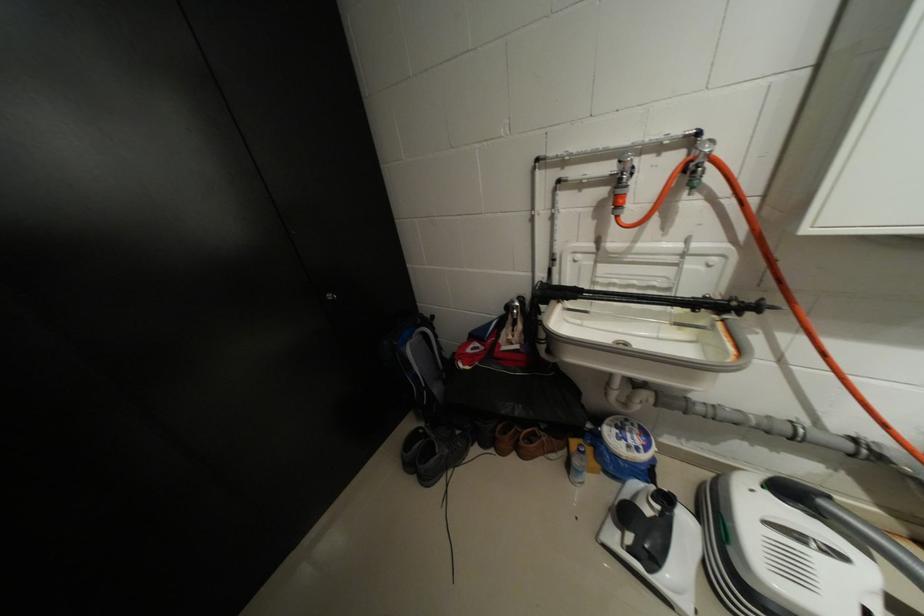
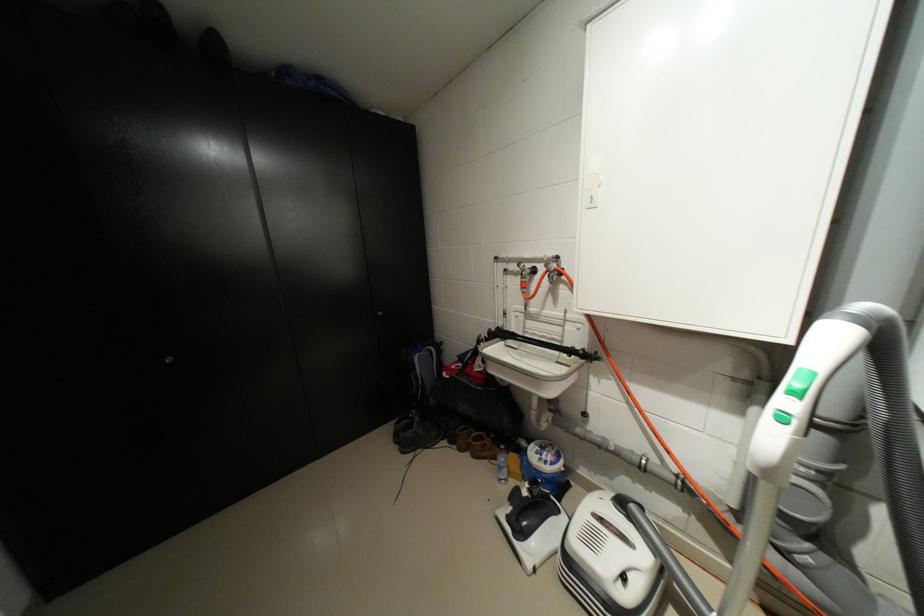
Question: The first image is from the beginning of the video and the second image is from the end. How did the camera likely rotate when shooting the video?

Choices:
 (A) Left
 (B) Right
 (C) Up
 (D) Down

Answer: (A)